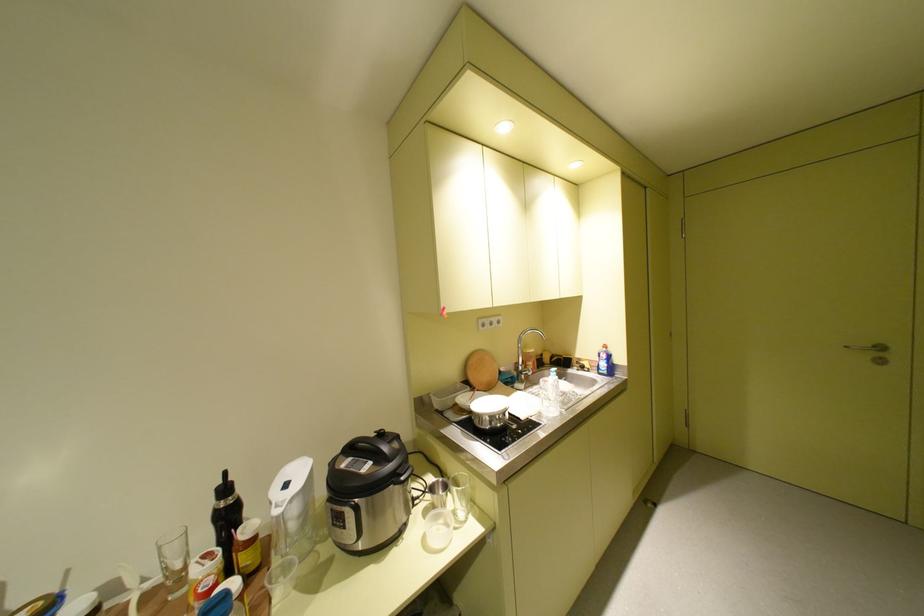
Describe the element at coordinates (868, 347) in the screenshot. The image size is (924, 616). I see `a silver door handle` at that location.